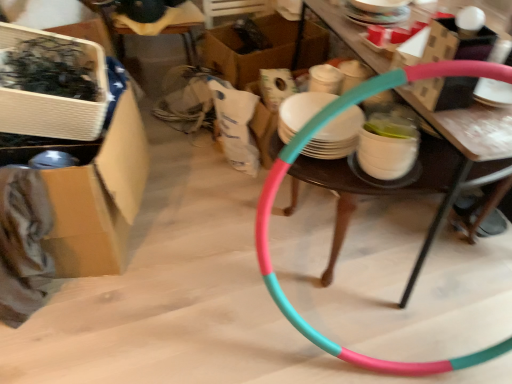
Question: Is there a large distance between white cardboard box at upper left, which is the third box in back-to-front order, and pink rubber hula hoop at center?

Choices:
 (A) no
 (B) yes

Answer: (A)

Question: From a real-world perspective, does white cardboard box at upper left, marked as the 1th box in a front-to-back arrangement, sit lower than pink rubber hula hoop at center?

Choices:
 (A) yes
 (B) no

Answer: (B)

Question: Does white cardboard box at upper left, which is the third box in back-to-front order, appear on the left side of pink rubber hula hoop at center?

Choices:
 (A) yes
 (B) no

Answer: (A)

Question: Is white cardboard box at upper left, which is the third box in back-to-front order, beside pink rubber hula hoop at center?

Choices:
 (A) yes
 (B) no

Answer: (B)

Question: From the image's perspective, is white cardboard box at upper left, marked as the 1th box in a front-to-back arrangement, located above pink rubber hula hoop at center?

Choices:
 (A) no
 (B) yes

Answer: (B)

Question: Is cardboard box at center, the 1th box viewed from the back, to the left or to the right of white cardboard box at upper left, marked as the 1th box in a front-to-back arrangement, in the image?

Choices:
 (A) right
 (B) left

Answer: (A)

Question: From a real-world perspective, relative to white cardboard box at upper left, marked as the 1th box in a front-to-back arrangement, is cardboard box at center, the third box viewed from the front, vertically above or below?

Choices:
 (A) below
 (B) above

Answer: (A)

Question: Is point (279, 26) positioned closer to the camera than point (4, 127)?

Choices:
 (A) closer
 (B) farther

Answer: (B)

Question: Looking at their shapes, would you say cardboard box at center, the third box viewed from the front, is wider or thinner than white cardboard box at upper left, which is the third box in back-to-front order?

Choices:
 (A) wide
 (B) thin

Answer: (A)

Question: Is teal plastic hoop at center to the left or to the right of cardboard box at left, which is counted as the second box, starting from the back, in the image?

Choices:
 (A) right
 (B) left

Answer: (A)

Question: In the image, is teal plastic hoop at center positioned in front of or behind cardboard box at left, which is counted as the second box, starting from the back?

Choices:
 (A) front
 (B) behind

Answer: (A)

Question: Is teal plastic hoop at center wider or thinner than cardboard box at left, which is counted as the second box, starting from the back?

Choices:
 (A) thin
 (B) wide

Answer: (A)

Question: From their relative heights in the image, would you say teal plastic hoop at center is taller or shorter than cardboard box at left, which is counted as the second box, starting from the back?

Choices:
 (A) short
 (B) tall

Answer: (A)

Question: In the image, is pink rubber hula hoop at center positioned in front of or behind wooden chair at upper center?

Choices:
 (A) behind
 (B) front

Answer: (B)

Question: In the image, is pink rubber hula hoop at center on the left side or the right side of wooden chair at upper center?

Choices:
 (A) left
 (B) right

Answer: (B)